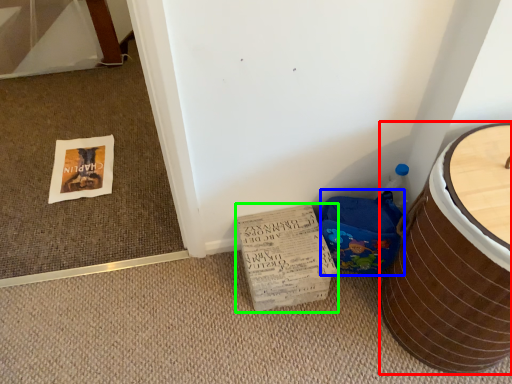
Question: Which is nearer to the furniture (highlighted by a red box)? potty (highlighted by a blue box) or cardboard (highlighted by a green box).

Choices:
 (A) potty
 (B) cardboard

Answer: (A)